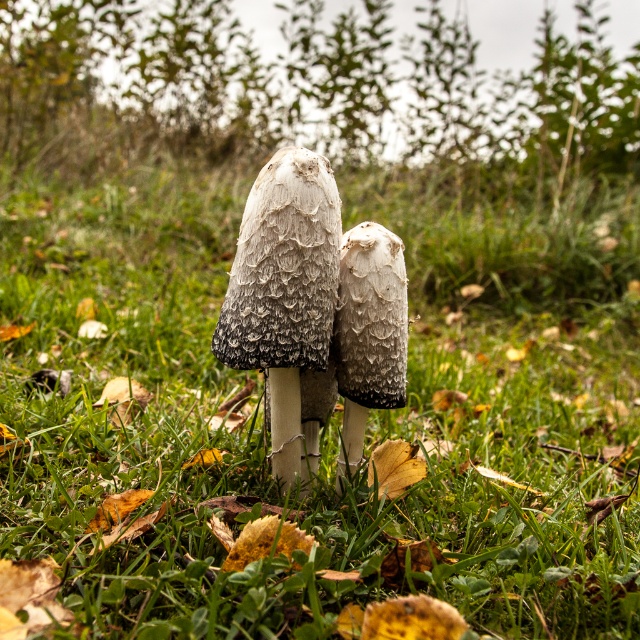
Question: Among these points, which one is nearest to the camera?

Choices:
 (A) (296, 272)
 (B) (387, 392)

Answer: (A)

Question: Considering the relative positions of fuzzy white mushroom at center and fuzzy gray mushroom at center in the image provided, where is fuzzy white mushroom at center located with respect to fuzzy gray mushroom at center?

Choices:
 (A) above
 (B) below

Answer: (A)

Question: Is fuzzy white mushroom at center positioned behind fuzzy gray mushroom at center?

Choices:
 (A) no
 (B) yes

Answer: (A)

Question: Which object is farther from the camera taking this photo?

Choices:
 (A) fuzzy gray mushroom at center
 (B) fuzzy white mushroom at center

Answer: (A)

Question: Is fuzzy white mushroom at center thinner than fuzzy gray mushroom at center?

Choices:
 (A) yes
 (B) no

Answer: (B)